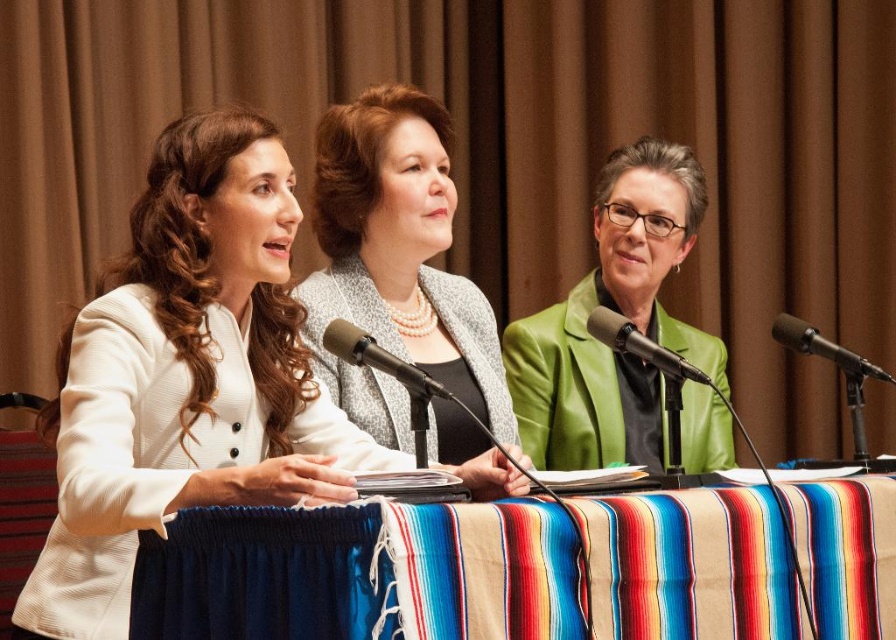
In the scene shown: You are a photographer trying to capture a closeup of the metallic green microphone at center during the panel discussion. To avoid including the striped fabric tablecloth at center in the photo, where should you position your camera relative to the microphone?

The striped fabric tablecloth at center is located below the metallic green microphone at center, so positioning the camera above the microphone would allow you to avoid capturing the tablecloth in the shot.

You are sitting at the back of the room and want to focus on the panelist who is closer to you. Which point should you look at, point (126, 476) or point (398, 417)?

You should look at point (126, 476) because it is closer to the viewer than point (398, 417).

You are an event organizer preparing for a panel discussion. You need to ensure that all participants can be seen clearly by the audience. Given the scene described, which of the two jackets at the center, the matte gray blazer at center or the green leather jacket at center, should you adjust the seating to accommodate for visibility?

The green leather jacket at center is taller than the matte gray blazer at center, so adjusting the seating to position the participant wearing the green leather jacket at center slightly behind or to the side might improve visibility for the person in the matte gray blazer at center.